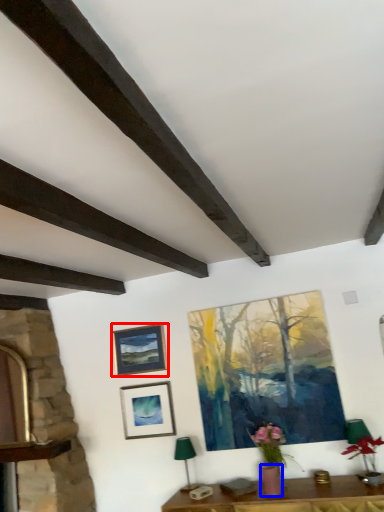
Question: Which object is closer to the camera taking this photo, picture frame (highlighted by a red box) or flowerpot (highlighted by a blue box)?

Choices:
 (A) picture frame
 (B) flowerpot

Answer: (B)